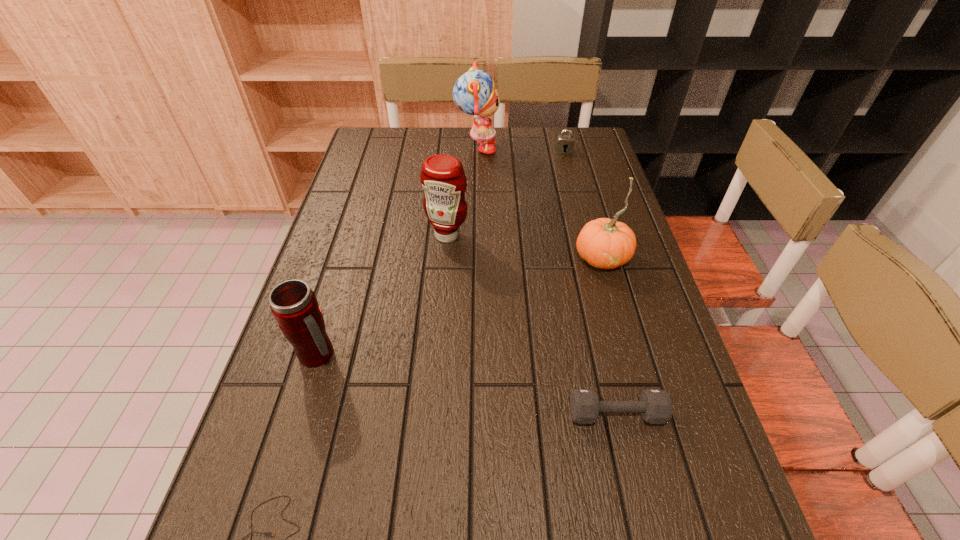
Image resolution: width=960 pixels, height=540 pixels. Identify the location of doll. (475, 93).

The image size is (960, 540). Find the location of `condiment`. condiment is located at coordinates (442, 177).

You are a GUI agent. You are given a task and a screenshot of the screen. Output one action in this format:
    pyautogui.click(x=<x>, y=<y>)
    Task: Click on the pumpkin
    This screenshot has height=540, width=960.
    Given the screenshot: What is the action you would take?
    pyautogui.click(x=604, y=243)

Identify the location of thermos bottle. (293, 304).

What are the coordinates of `padlock` in the screenshot? It's located at (564, 143).

At what (x,y) coordinates should I click in order to perform the action: click on the sixth farthest object. Please return your answer as a coordinate pair (x, y). Looking at the image, I should click on (655, 405).

The image size is (960, 540). What are the coordinates of `dumbbell` in the screenshot? It's located at (655, 405).

Locate an element on the screen. vacant space located 0.060m on the face of the doll is located at coordinates (516, 149).

The image size is (960, 540). In order to click on vacant area situated 0.270m on the back of the condiment in this screenshot , I will do `click(452, 172)`.

What are the coordinates of `vacant position located on the back of the pumpkin` in the screenshot? It's located at (581, 182).